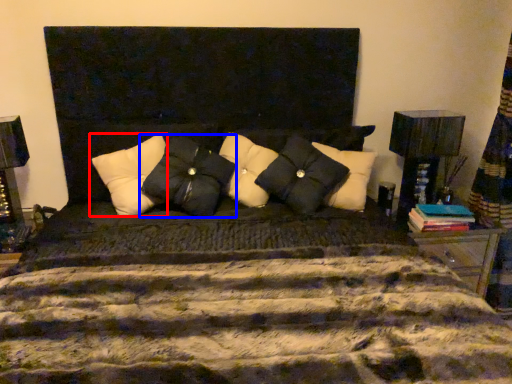
Question: Which point is closer to the camera, pillow (highlighted by a red box) or pillow (highlighted by a blue box)?

Choices:
 (A) pillow
 (B) pillow

Answer: (B)